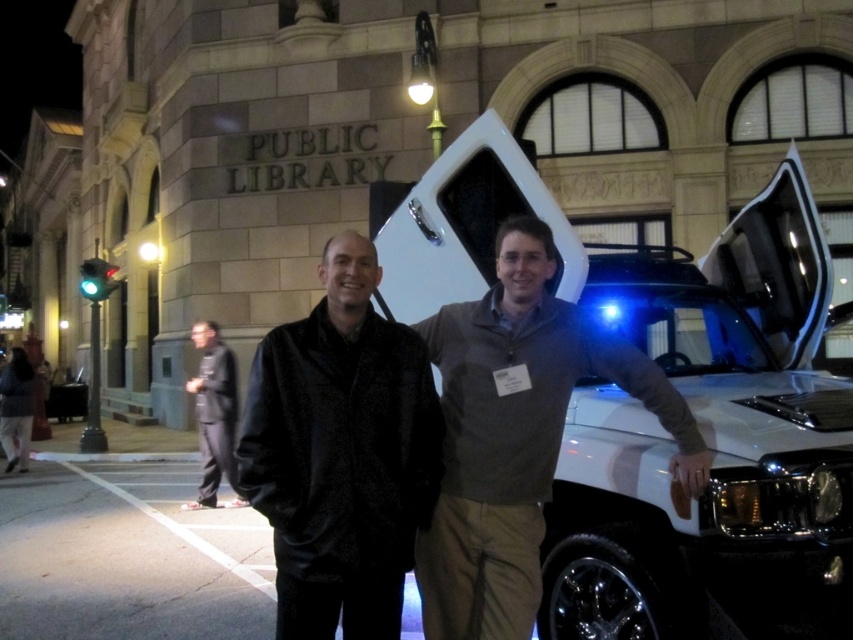
You are a photographer taking a picture of the white glossy suv at right and the dark gray suit at left. Which object is taller in the photo?

The dark gray suit at left is taller than the white glossy suv at right.

You are a photographer at the library event. You need to decide which clothing item to focus on for a closeup shot. Which one is smaller in size between the black textured jacket at center and the dark gray suit at left?

The black textured jacket at center has a smaller size compared to the dark gray suit at left, so the black textured jacket at center is the smaller one and should be chosen for the closeup shot.